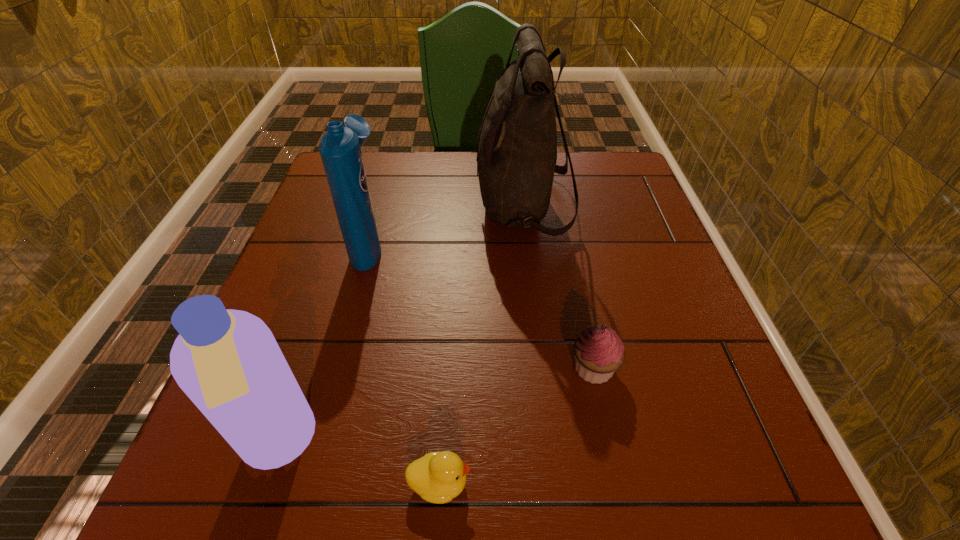
Locate an element on the screen. Image resolution: width=960 pixels, height=540 pixels. blank area located on the back of the farther shampoo is located at coordinates (383, 195).

Identify the location of free space located 0.060m on the right of the nearer shampoo. (354, 444).

Image resolution: width=960 pixels, height=540 pixels. I want to click on vacant region located 0.170m on the back of the cupcake, so click(x=576, y=284).

Locate an element on the screen. The image size is (960, 540). blank space located 0.240m on the beak of the shortest object is located at coordinates (633, 483).

Where is `object present at the far edge`? The width and height of the screenshot is (960, 540). object present at the far edge is located at coordinates (516, 159).

Locate an element on the screen. This screenshot has height=540, width=960. shampoo present at the near edge is located at coordinates (228, 363).

Where is `duckling that is at the near edge`? The height and width of the screenshot is (540, 960). duckling that is at the near edge is located at coordinates (438, 477).

The height and width of the screenshot is (540, 960). Find the location of `object situated at the near left corner`. object situated at the near left corner is located at coordinates (228, 363).

At what (x,y) coordinates should I click in order to perform the action: click on vacant space at the near edge of the desktop. Please return your answer as a coordinate pair (x, y). The image size is (960, 540). Looking at the image, I should click on (492, 457).

In the image, there is a desktop. Where is `free region at the left edge`? This screenshot has height=540, width=960. free region at the left edge is located at coordinates (324, 341).